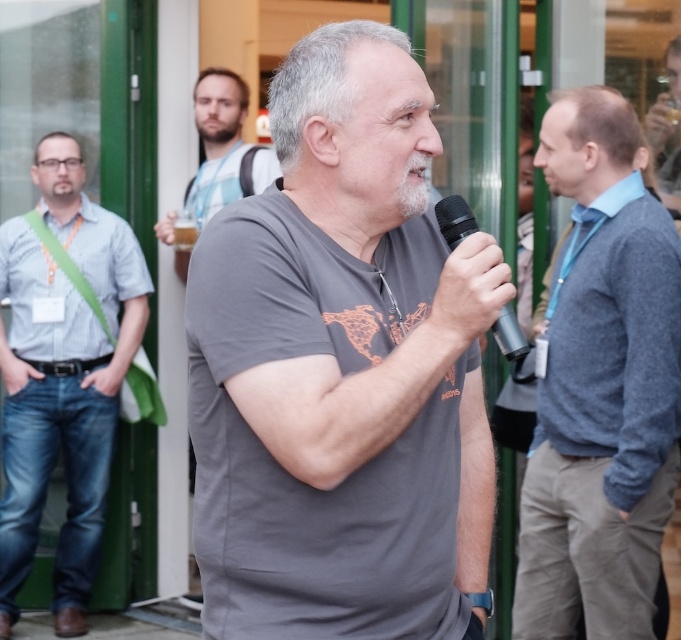
This screenshot has width=681, height=640. What do you see at coordinates (601, 387) in the screenshot?
I see `gray wool sweater at center` at bounding box center [601, 387].

Is gray wool sweater at center thinner than matte black shirt at center?

No, gray wool sweater at center is not thinner than matte black shirt at center.

Is point (533, 632) in front of point (665, 173)?

Yes, point (533, 632) is closer to viewer.

This screenshot has width=681, height=640. In order to click on gray wool sweater at center in this screenshot , I will do `click(601, 387)`.

Which is behind, point (197, 304) or point (665, 182)?

The point (665, 182) is behind.

Is gray matte t-shirt at center in front of matte black shirt at center?

That is True.

Which is in front, point (308, 42) or point (678, 131)?

Point (308, 42) is more forward.

The width and height of the screenshot is (681, 640). I want to click on gray matte t-shirt at center, so click(343, 369).

Does beige striped shirt at upper center have a smaller size compared to black metallic microphone at center?

No.

Consider the image. Who is higher up, beige striped shirt at upper center or black metallic microphone at center?

Positioned higher is beige striped shirt at upper center.

Between point (195, 177) and point (490, 330), which one is positioned behind?

The point (195, 177) is more distant.

The width and height of the screenshot is (681, 640). I want to click on beige striped shirt at upper center, so click(223, 145).